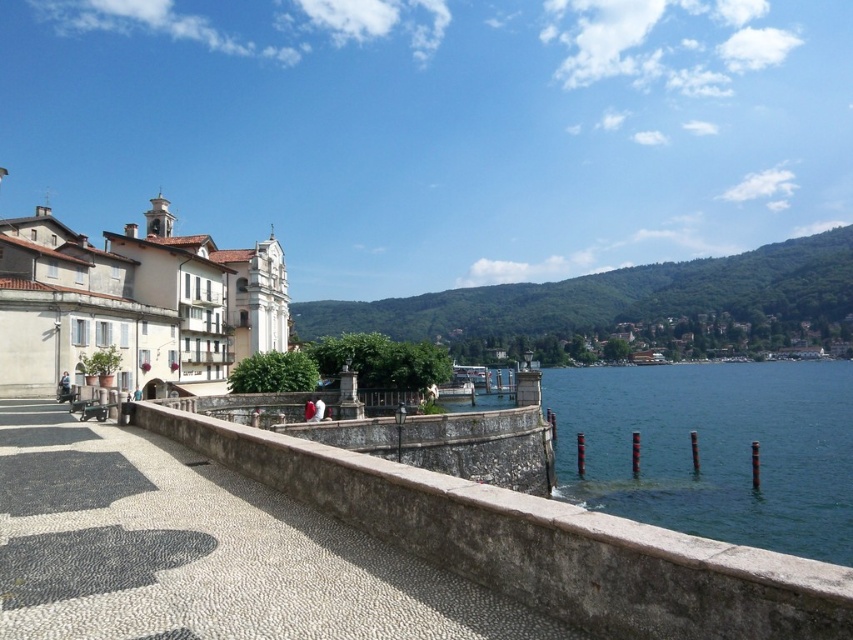
Identify the location of gray stone path at center. (200, 552).

Between gray stone path at center and white stone buildings at left, which one has less height?

Standing shorter between the two is gray stone path at center.

Is point (28, 548) behind point (26, 257)?

No, it is in front of (26, 257).

Identify the location of gray stone path at center. (200, 552).

Is greenish-blue water at lower right bigger than white stone buildings at left?

Indeed, greenish-blue water at lower right has a larger size compared to white stone buildings at left.

Is greenish-blue water at lower right thinner than white stone buildings at left?

In fact, greenish-blue water at lower right might be wider than white stone buildings at left.

Identify the location of greenish-blue water at lower right. (712, 449).

Is gray stone path at center wider than greenish-blue water at lower right?

No.

Is point (6, 618) more distant than point (662, 378)?

No, (6, 618) is closer to viewer.

Where is `gray stone path at center`? The height and width of the screenshot is (640, 853). gray stone path at center is located at coordinates (200, 552).

Find the location of a particular element. The image size is (853, 640). gray stone path at center is located at coordinates (200, 552).